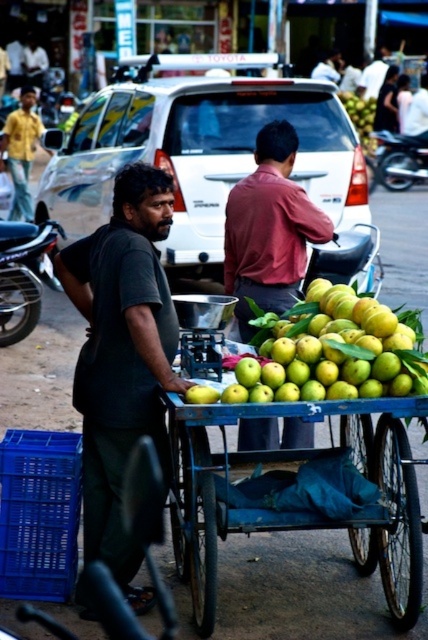
Question: Can you confirm if dark gray shirt at left is thinner than green matte apples at center?

Choices:
 (A) yes
 (B) no

Answer: (A)

Question: Which object appears farthest from the camera in this image?

Choices:
 (A) dark gray shirt at left
 (B) blue metallic cart at center

Answer: (A)

Question: Estimate the real-world distances between objects in this image. Which object is farther from the green matte apples at center?

Choices:
 (A) blue metallic cart at center
 (B) dark gray shirt at left

Answer: (B)

Question: Is blue metallic cart at center closer to the viewer compared to green matte apples at center?

Choices:
 (A) no
 (B) yes

Answer: (B)

Question: Which point appears closest to the camera in this image?

Choices:
 (A) coord(309,285)
 (B) coord(109,531)

Answer: (B)

Question: Can you confirm if blue metallic cart at center is positioned above green matte apples at center?

Choices:
 (A) no
 (B) yes

Answer: (A)